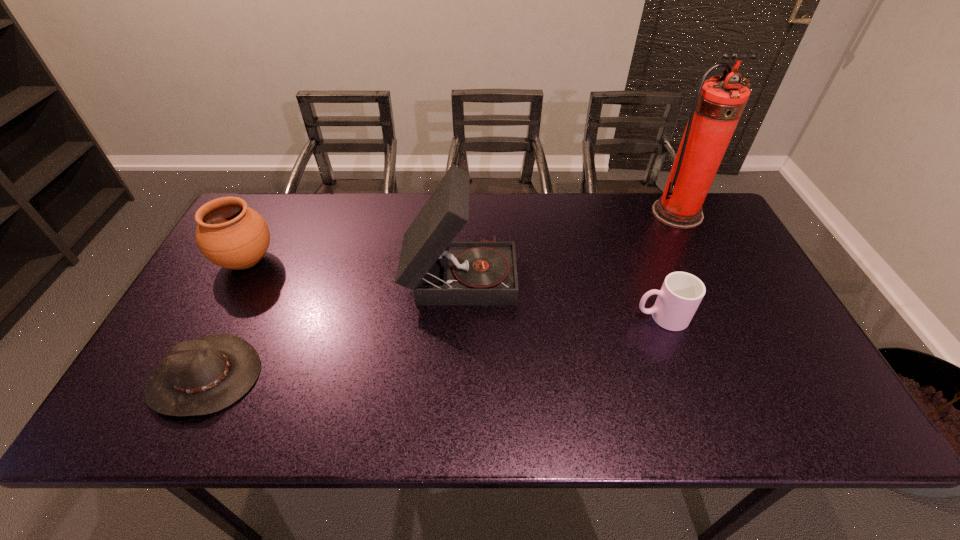
Locate an element on the screen. Image resolution: width=960 pixels, height=540 pixels. vacant space that is in between the third shortest object and the third object from right to left is located at coordinates (353, 267).

This screenshot has width=960, height=540. Find the location of `vacant area between the rightmost object and the third object from left to right`. vacant area between the rightmost object and the third object from left to right is located at coordinates pyautogui.click(x=568, y=244).

Image resolution: width=960 pixels, height=540 pixels. Find the location of `blank region between the fire extinguisher and the fourth tallest object`. blank region between the fire extinguisher and the fourth tallest object is located at coordinates (669, 265).

Identify the location of vacant space that's between the pottery and the phonograph_record. (353, 267).

Point out which object is positioned as the nearest to the third shortest object. Please provide its 2D coordinates. Your answer should be formatted as a tuple, i.e. [(x, y)], where the tuple contains the x and y coordinates of a point satisfying the conditions above.

[(203, 376)]

Locate an element on the screen. The image size is (960, 540). object that is the third closest to the fourth shortest object is located at coordinates (229, 234).

Locate an element on the screen. free space that satisfies the following two spatial constraints: 1. at the discharge end of the fire extinguisher; 2. on the front-facing side of the phonograph_record is located at coordinates (708, 274).

At what (x,y) coordinates should I click in order to perform the action: click on vacant space that satisfies the following two spatial constraints: 1. on the front-facing side of the third object from left to right; 2. on the front-facing side of the hat. Please return your answer as a coordinate pair (x, y). Image resolution: width=960 pixels, height=540 pixels. Looking at the image, I should click on (455, 376).

Where is `vacant space that satisfies the following two spatial constraints: 1. with the handle on the side of the fourth tallest object; 2. on the front side of the third shortest object`? vacant space that satisfies the following two spatial constraints: 1. with the handle on the side of the fourth tallest object; 2. on the front side of the third shortest object is located at coordinates (641, 261).

Where is `blank area in the image that satisfies the following two spatial constraints: 1. with the handle on the side of the cup; 2. on the front-facing side of the fourth shortest object`? blank area in the image that satisfies the following two spatial constraints: 1. with the handle on the side of the cup; 2. on the front-facing side of the fourth shortest object is located at coordinates tap(645, 274).